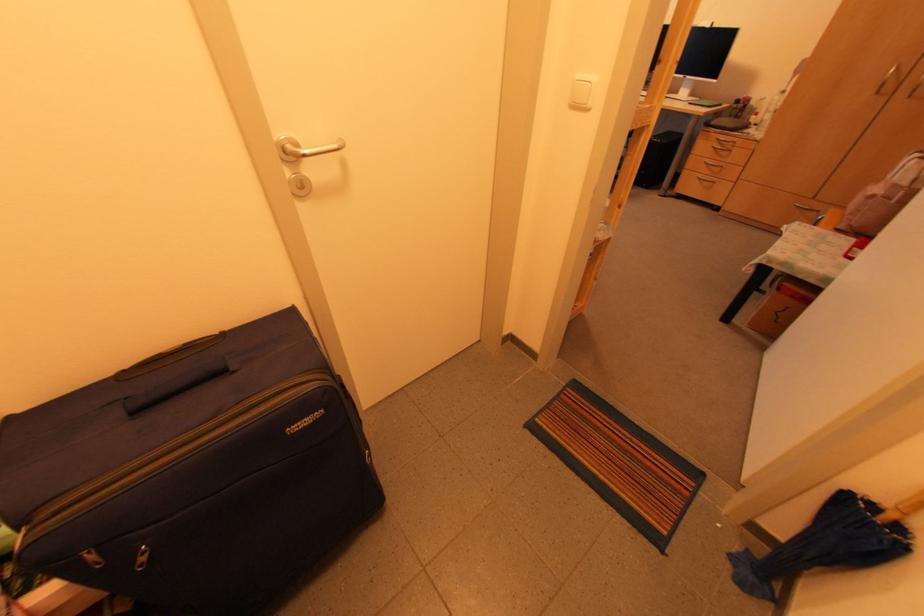
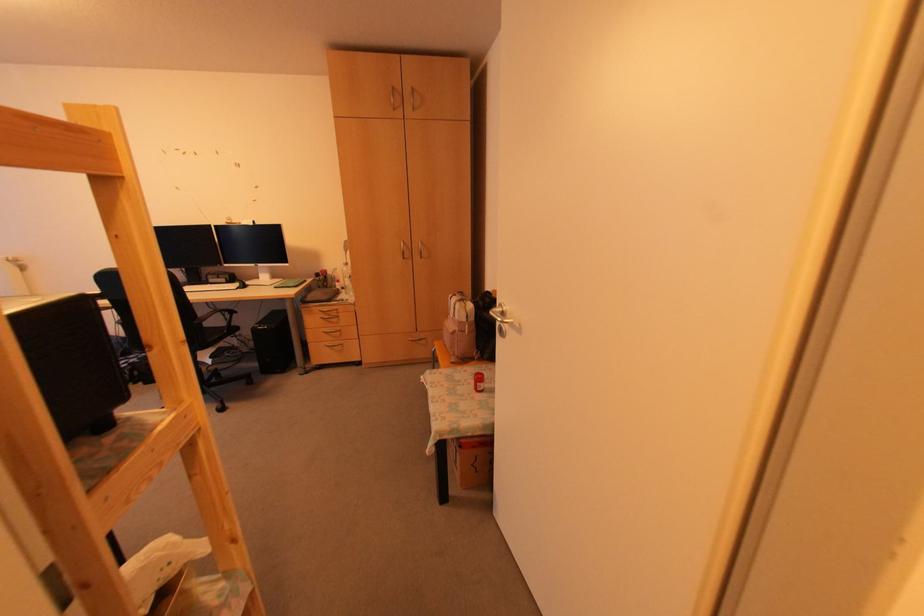
Question: The first image is from the beginning of the video and the second image is from the end. How did the camera likely rotate when shooting the video?

Choices:
 (A) Left
 (B) Right
 (C) Up
 (D) Down

Answer: (B)